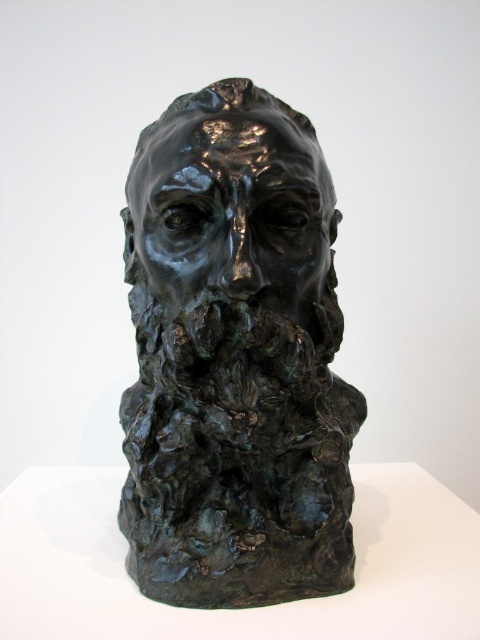
Between bronze textured head at center and shiny bronze face at center, which one appears on the right side from the viewer's perspective?

From the viewer's perspective, bronze textured head at center appears more on the right side.

Between bronze textured head at center and shiny bronze face at center, which one appears on the left side from the viewer's perspective?

shiny bronze face at center

Is point (153, 536) farther from camera compared to point (194, 257)?

Yes, it is behind point (194, 257).

This screenshot has width=480, height=640. In order to click on bronze textured head at center in this screenshot , I will do pyautogui.click(x=235, y=358).